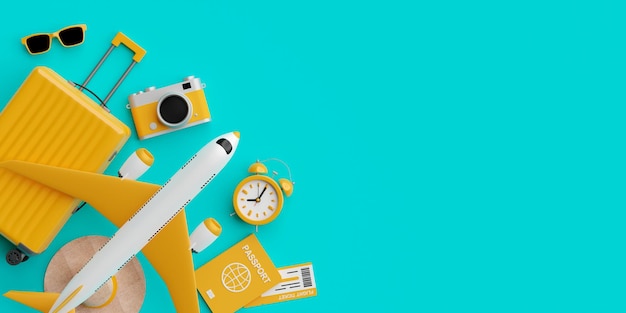
This screenshot has height=313, width=626. Find the location of `yellow bells on alarm clock`. yellow bells on alarm clock is located at coordinates (258, 169), (285, 187).